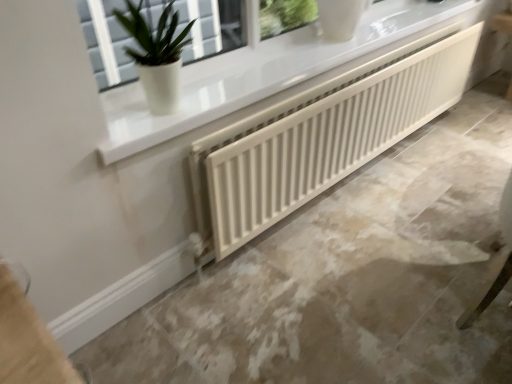
Measure the distance between point (371, 100) and camera.

1.74 meters.

Locate an element on the screen. green matte plant at upper left is located at coordinates (156, 54).

Is white matte radiator at center facing towards white ribbed radiator at center?

No.

Can you confirm if white matte radiator at center is bigger than white ribbed radiator at center?

Indeed, white matte radiator at center has a larger size compared to white ribbed radiator at center.

Which object is positioned more to the left, white matte radiator at center or white ribbed radiator at center?

white ribbed radiator at center is more to the left.

Looking at this image, considering the relative sizes of white ribbed radiator at center and white matte radiator at center in the image provided, is white ribbed radiator at center smaller than white matte radiator at center?

Yes.

Could you tell me if white ribbed radiator at center is facing white matte radiator at center?

No, white ribbed radiator at center is not aimed at white matte radiator at center.

Who is taller, white ribbed radiator at center or white matte radiator at center?

With more height is white ribbed radiator at center.

Does white ribbed radiator at center turn towards green matte plant at upper left?

No, white ribbed radiator at center is not facing towards green matte plant at upper left.

Which is farther from the camera, (465, 56) or (159, 18)?

The point (465, 56) is farther.

From the image's perspective, between white ribbed radiator at center and green matte plant at upper left, which one is located above?

green matte plant at upper left appears higher in the image.

At what (x,y) coordinates should I click in order to perform the action: click on houseplant located in front of the white ribbed radiator at center. Please return your answer as a coordinate pair (x, y). The height and width of the screenshot is (384, 512). Looking at the image, I should click on (156, 54).

This screenshot has height=384, width=512. I want to click on houseplant lying behind the white matte radiator at center, so click(156, 54).

Which of these two, green matte plant at upper left or white matte radiator at center, is smaller?

Smaller between the two is green matte plant at upper left.

From a real-world perspective, which object stands above the other?

From a 3D spatial view, green matte plant at upper left is above.

How many degrees apart are the facing directions of green matte plant at upper left and white ribbed radiator at center?

green matte plant at upper left and white ribbed radiator at center are facing 0.43 degrees away from each other.

Which point is more forward, (131, 28) or (265, 131)?

The point (131, 28) is closer to the camera.

Considering the sizes of objects green matte plant at upper left and white ribbed radiator at center in the image provided, who is bigger, green matte plant at upper left or white ribbed radiator at center?

With larger size is white ribbed radiator at center.

From the picture: Is white ribbed radiator at center located within green matte plant at upper left?

No, white ribbed radiator at center is not a part of green matte plant at upper left.

Considering the relative positions of white matte radiator at center and green matte plant at upper left in the image provided, is white matte radiator at center to the right of green matte plant at upper left from the viewer's perspective?

Indeed, white matte radiator at center is positioned on the right side of green matte plant at upper left.

In the scene shown: Is white matte radiator at center oriented away from green matte plant at upper left?

white matte radiator at center does not have its back to green matte plant at upper left.

From a real-world perspective, is white matte radiator at center above or below green matte plant at upper left?

white matte radiator at center is situated lower than green matte plant at upper left in the real world.

Identify the location of concrete that appears below the green matte plant at upper left (from a real-world perspective). Image resolution: width=512 pixels, height=384 pixels. (349, 278).

Identify the location of concrete that appears below the white ribbed radiator at center (from a real-world perspective). (349, 278).

Where is `concrete that appears on the right of white ribbed radiator at center`? concrete that appears on the right of white ribbed radiator at center is located at coordinates (349, 278).

Based on their spatial positions, is white matte radiator at center or green matte plant at upper left further from white ribbed radiator at center?

green matte plant at upper left is positioned further to the anchor white ribbed radiator at center.

Which object lies nearer to the anchor point white matte radiator at center, green matte plant at upper left or white ribbed radiator at center?

Based on the image, white ribbed radiator at center appears to be nearer to white matte radiator at center.

Considering their positions, is white ribbed radiator at center positioned closer to white matte radiator at center than green matte plant at upper left?

Based on the image, white ribbed radiator at center appears to be nearer to white matte radiator at center.

Based on their spatial positions, is green matte plant at upper left or white matte radiator at center further from white ribbed radiator at center?

Among the two, green matte plant at upper left is located further to white ribbed radiator at center.

Looking at this image, which object lies nearer to the anchor point green matte plant at upper left, white ribbed radiator at center or white matte radiator at center?

white ribbed radiator at center is closer to green matte plant at upper left.

Considering their positions, is white matte radiator at center positioned further to green matte plant at upper left than white ribbed radiator at center?

white matte radiator at center is further to green matte plant at upper left.

The image size is (512, 384). In order to click on radiator between green matte plant at upper left and white matte radiator at center in this screenshot , I will do `click(320, 137)`.